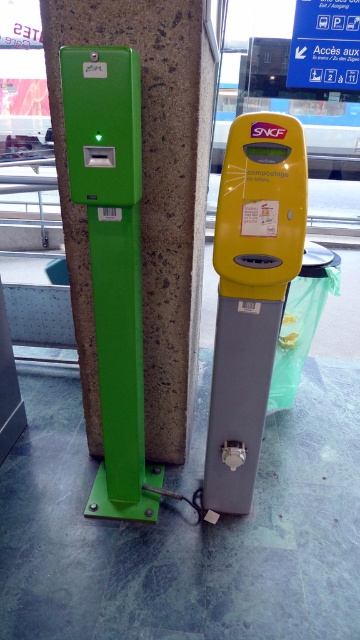
Question: Is green plastic card reader at left to the left of yellow plastic parking meter at center from the viewer's perspective?

Choices:
 (A) yes
 (B) no

Answer: (A)

Question: Among these objects, which one is nearest to the camera?

Choices:
 (A) green plastic card reader at left
 (B) yellow plastic parking meter at center

Answer: (B)

Question: Which of the following is the closest to the observer?

Choices:
 (A) (177, 72)
 (B) (205, 486)

Answer: (A)

Question: Does green plastic card reader at left have a greater width compared to yellow plastic parking meter at center?

Choices:
 (A) yes
 (B) no

Answer: (A)

Question: Does green plastic card reader at left lie in front of yellow plastic parking meter at center?

Choices:
 (A) yes
 (B) no

Answer: (B)